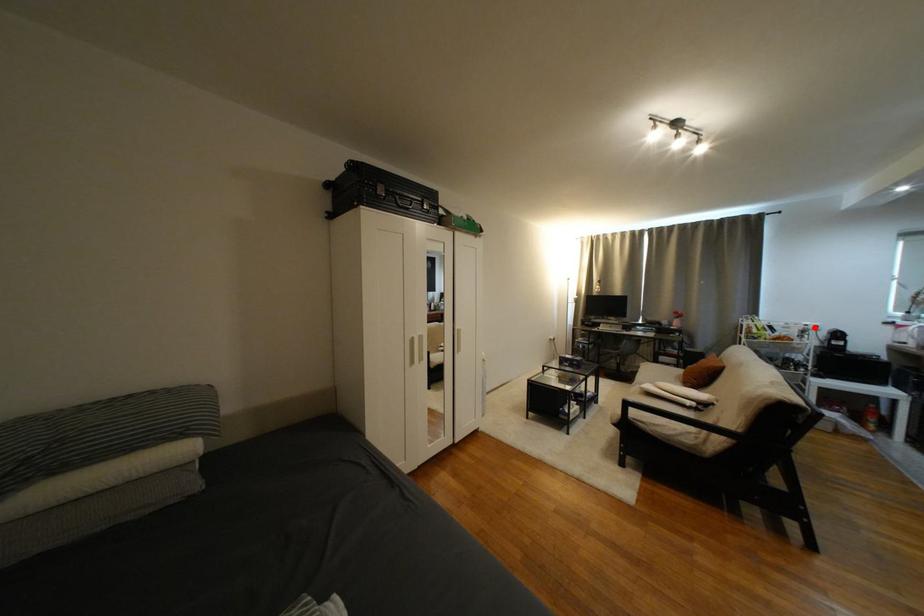
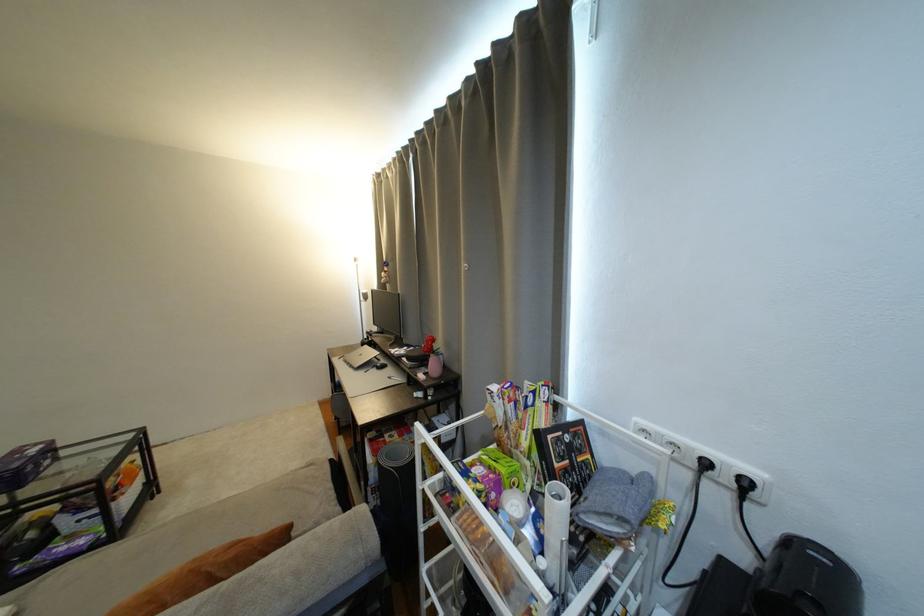
Locate, in the second image, the point that corresponds to the highlighted location in the first image.

(714, 466)